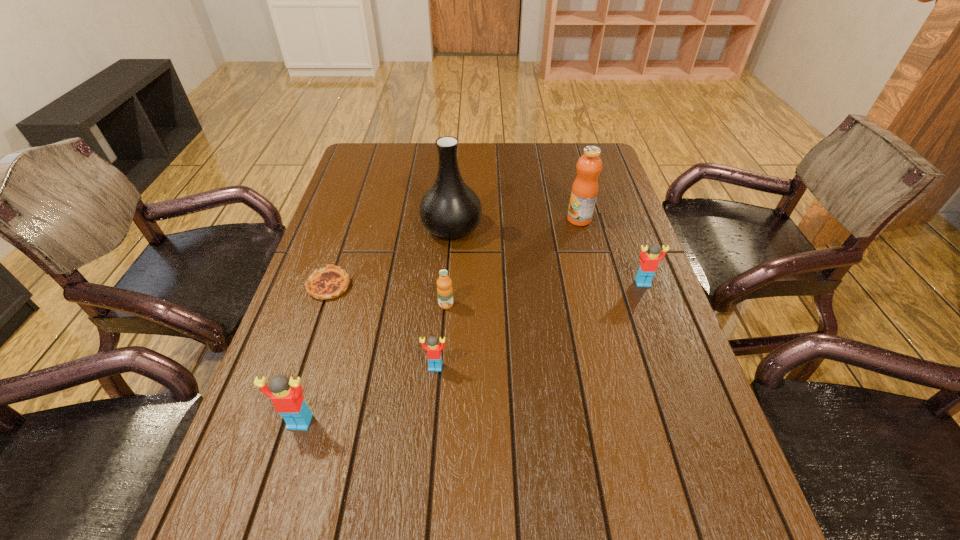
The width and height of the screenshot is (960, 540). In order to click on unoccupied position between the third tallest object and the second Lego from left to right in this screenshot , I will do `click(368, 394)`.

The height and width of the screenshot is (540, 960). Identify the location of vacant area between the vase and the farthest Lego. (547, 255).

This screenshot has height=540, width=960. I want to click on free space between the shortest Lego and the shortest object, so click(382, 326).

You are a GUI agent. You are given a task and a screenshot of the screen. Output one action in this format:
    pyautogui.click(x=<x>, y=<y>)
    Task: Click on the free space between the shortest object and the leftmost Lego
    Image resolution: width=960 pixels, height=540 pixels.
    Given the screenshot: What is the action you would take?
    pyautogui.click(x=314, y=354)

In order to click on vacant point located between the sixth farthest object and the third tallest object in this screenshot , I will do `click(368, 394)`.

Identify the location of free point between the orange juice and the sixth farthest object. [441, 335].

Identify the location of vacant area between the fruit juice and the second Lego from left to right. The width and height of the screenshot is (960, 540). (507, 293).

This screenshot has height=540, width=960. Find the location of `free space between the orange juice and the tallest Lego`. free space between the orange juice and the tallest Lego is located at coordinates (372, 363).

Where is `object that is the closest to the rightmost Lego`? The height and width of the screenshot is (540, 960). object that is the closest to the rightmost Lego is located at coordinates (584, 191).

I want to click on the second closest object to the farthest Lego, so click(x=450, y=209).